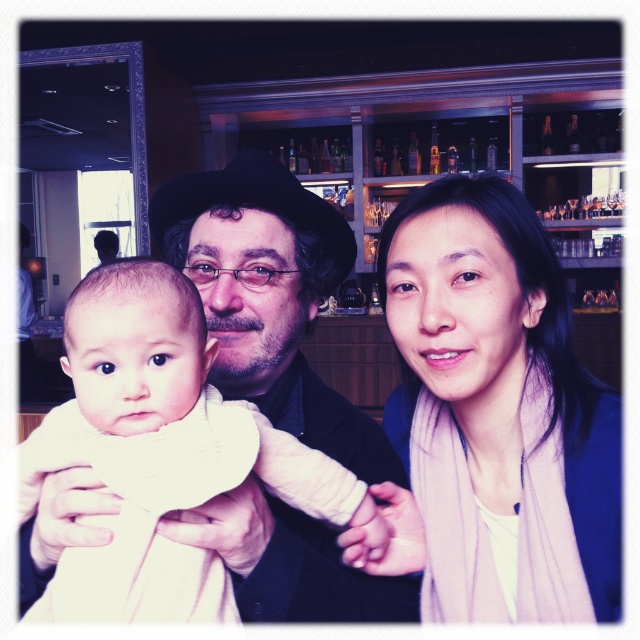
Question: Which point is closer to the camera?

Choices:
 (A) (172, 388)
 (B) (460, 474)

Answer: (A)

Question: Can you confirm if pink scarf at center is positioned below white soft cloth at center?

Choices:
 (A) no
 (B) yes

Answer: (A)

Question: Can you confirm if pink scarf at center is wider than white soft cloth at center?

Choices:
 (A) no
 (B) yes

Answer: (A)

Question: Can you confirm if pink scarf at center is positioned to the left of white soft cloth at center?

Choices:
 (A) no
 (B) yes

Answer: (A)

Question: Which object is closer to the camera taking this photo?

Choices:
 (A) white soft cloth at center
 (B) pink scarf at center

Answer: (A)